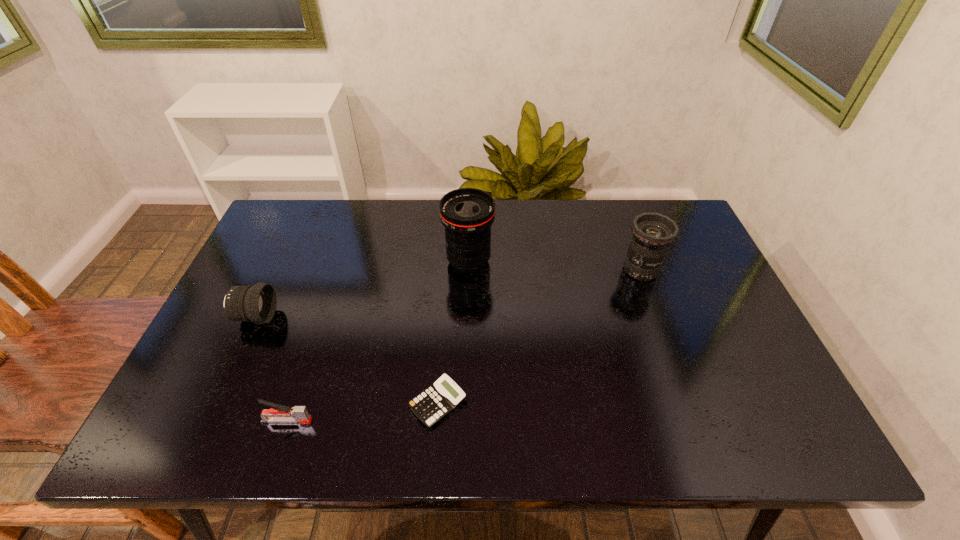
Locate an element on the screen. The width and height of the screenshot is (960, 540). vacant space that's between the nearest telephoto lens and the shortest object is located at coordinates 347,360.

The width and height of the screenshot is (960, 540). I want to click on free space that is in between the rightmost telephoto lens and the third tallest object, so (x=448, y=293).

At what (x,y) coordinates should I click in order to perform the action: click on vacant space that's between the nearest telephoto lens and the tallest telephoto lens. Please return your answer as a coordinate pair (x, y). Image resolution: width=960 pixels, height=540 pixels. Looking at the image, I should click on (362, 289).

Where is `free space between the second shortest object and the shortest telephoto lens`? This screenshot has height=540, width=960. free space between the second shortest object and the shortest telephoto lens is located at coordinates (272, 369).

Locate an element on the screen. The image size is (960, 540). empty space that is in between the nearest telephoto lens and the tallest telephoto lens is located at coordinates (362, 289).

Find the location of a particular element. the closest object to the fourth object from right to left is located at coordinates (438, 400).

The width and height of the screenshot is (960, 540). Identify the location of object that can be found as the fourth closest to the stapler. (653, 233).

Identify which telephoto lens is the nearest to the tallest telephoto lens. Please provide its 2D coordinates. Your answer should be formatted as a tuple, i.e. [(x, y)], where the tuple contains the x and y coordinates of a point satisfying the conditions above.

[(653, 233)]

Identify which telephoto lens is the second nearest to the second object from left to right. Please provide its 2D coordinates. Your answer should be formatted as a tuple, i.e. [(x, y)], where the tuple contains the x and y coordinates of a point satisfying the conditions above.

[(467, 214)]

Identify the location of vacant space that satisfies the following two spatial constraints: 1. at the front element of the nearest telephoto lens; 2. on the left side of the calculator. (216, 403).